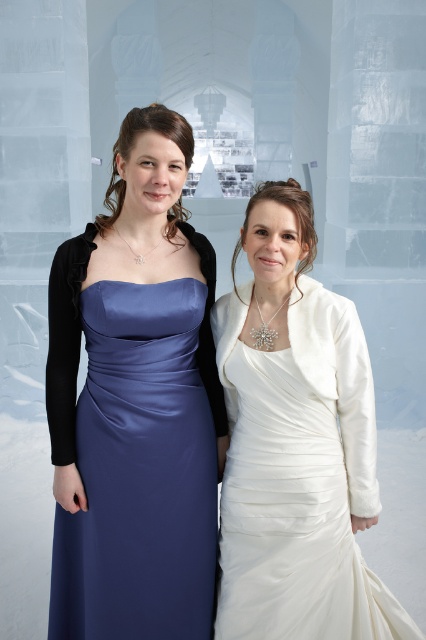
You are a photographer at a winter event. You need to position two models wearing the satin dress at left and the white satin dress at right. The venue has a narrow walkway that can only accommodate one dress width at a time. Which dress should you place first to ensure the narrower one goes through the walkway?

The white satin dress at right is narrower than the satin dress at left, so you should place the white satin dress at right first to ensure it can pass through the narrow walkway.

Consider the image. You are a photographer at a winter event. You need to capture both the satin dress at left and the white satin dress at right in a single shot. Based on their positions, which dress is higher in the frame?

The satin dress at left is located above the white satin dress at right, so it is higher in the frame.

You are a photographer standing 5 feet away from the two women. You want to capture a photo where both the satin dress at left and the white satin dress at right are in focus. Given that your camera has a depth of field that can cover 12 inches, will you be able to capture both dresses clearly in the same frame?

The distance between the satin dress at left and the white satin dress at right is 11.36 inches, which is within the camera depth of field of 12 inches. Therefore, both dresses will be in focus in the photo.